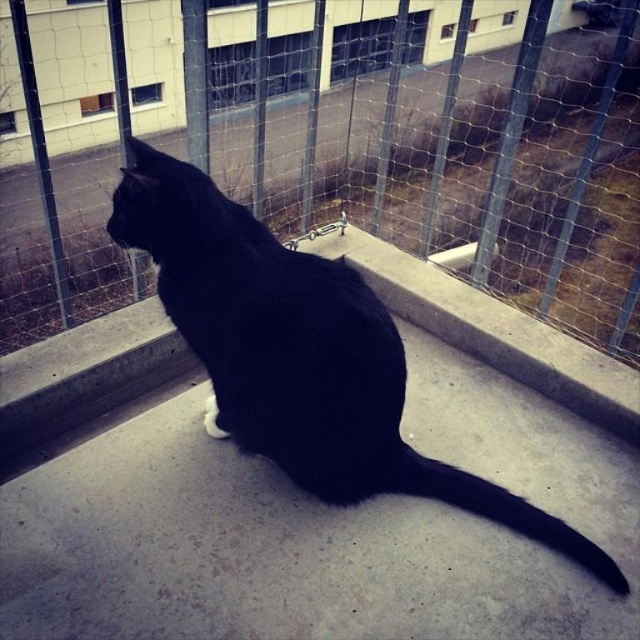
Does metal mesh fence at upper center appear under black matte fur cat at center?

Incorrect, metal mesh fence at upper center is not positioned below black matte fur cat at center.

Describe the element at coordinates (336, 141) in the screenshot. I see `metal mesh fence at upper center` at that location.

Find the location of `metal mesh fence at upper center`. metal mesh fence at upper center is located at coordinates (x=336, y=141).